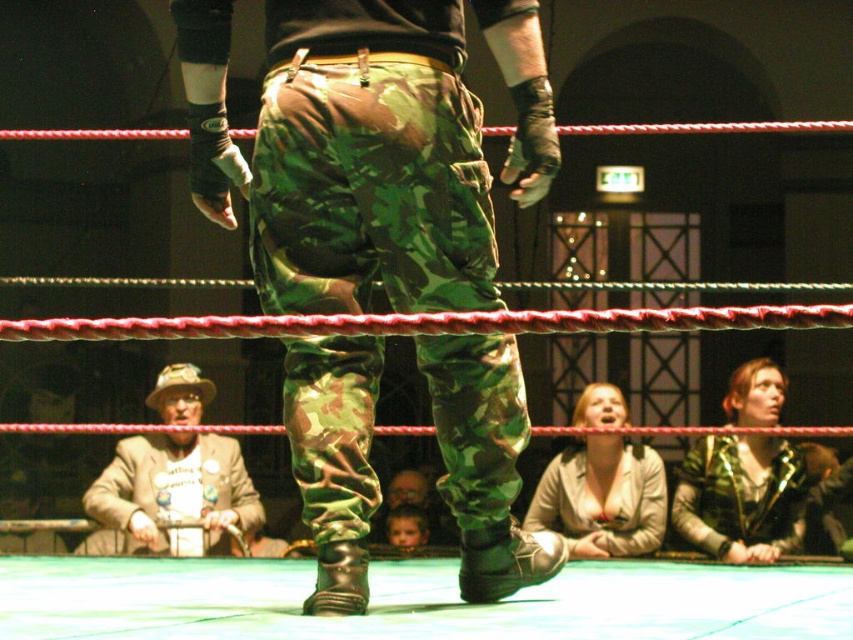
You are a photographer positioned behind the wrestling ring. You want to take a photo that includes both point (x=318, y=404) and point (x=164, y=522). Which point should you focus on to ensure both are in sharp focus?

You should focus on point (x=318, y=404) because it is closer to the camera than point (x=164, y=522). By focusing on the closer point, the farther point will still be within the depth of field and remain sharp.

You are a photographer positioned at the edge of the wrestling ring. You need to capture a clear shot of both the camo pants at center and the leather jacket at lower center. Which object should you focus on first to ensure both are in frame?

You should focus on the camo pants at center first since it is in front of the leather jacket at lower center, ensuring both are visible in the frame.